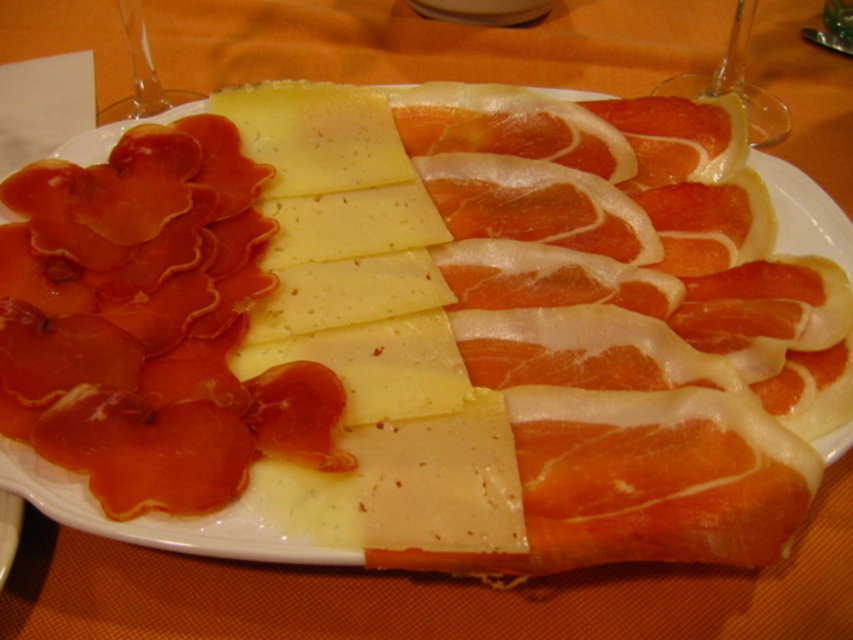
Question: Is yellow cheese at center above transparent glass at upper left?

Choices:
 (A) yes
 (B) no

Answer: (B)

Question: Which object is farther from the camera taking this photo?

Choices:
 (A) transparent glass at upper center
 (B) yellow cheese at center

Answer: (A)

Question: Which object appears closest to the camera in this image?

Choices:
 (A) transparent glass at upper center
 (B) transparent glass at upper left

Answer: (B)

Question: Observing the image, what is the correct spatial positioning of yellow cheese at center in reference to transparent glass at upper left?

Choices:
 (A) above
 (B) below

Answer: (B)

Question: Observing the image, what is the correct spatial positioning of transparent glass at upper center in reference to transparent glass at upper left?

Choices:
 (A) below
 (B) above

Answer: (A)

Question: Among these points, which one is farthest from the camera?

Choices:
 (A) (376, 209)
 (B) (686, 76)

Answer: (B)